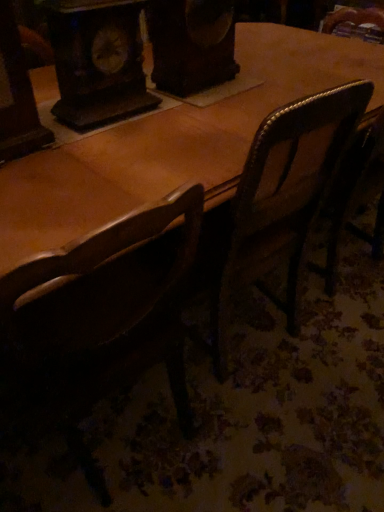
This screenshot has width=384, height=512. What are the coordinates of `brown wooden chair at left` in the screenshot? It's located at (105, 298).

The image size is (384, 512). Describe the element at coordinates (105, 298) in the screenshot. I see `brown wooden chair at left` at that location.

What do you see at coordinates (98, 61) in the screenshot? I see `wooden clock at upper left` at bounding box center [98, 61].

The image size is (384, 512). Identify the location of wooden clock at upper left. (98, 61).

The width and height of the screenshot is (384, 512). What are the coordinates of `brown wooden chair at left` in the screenshot? It's located at (105, 298).

Is brown wooden chair at left to the right of wooden clock at upper left from the viewer's perspective?

Yes.

Is brown wooden chair at left further to the viewer compared to wooden clock at upper left?

No, it is not.

Does point (15, 307) come behind point (134, 38)?

That is False.

From the image's perspective, between brown wooden chair at left and wooden clock at upper left, who is located below?

brown wooden chair at left appears lower in the image.

From a real-world perspective, is brown wooden chair at left over wooden clock at upper left?

Actually, brown wooden chair at left is physically below wooden clock at upper left in the real world.

In the scene shown: Looking at their sizes, would you say brown wooden chair at left is wider or thinner than wooden clock at upper left?

Result: Considering their sizes, brown wooden chair at left looks broader than wooden clock at upper left.

Can you confirm if brown wooden chair at left is shorter than wooden clock at upper left?

No.

Between brown wooden chair at left and wooden clock at upper left, which one has larger size?

brown wooden chair at left is bigger.

Is brown wooden chair at left outside of wooden clock at upper left?

Yes.

Would you consider brown wooden chair at left to be distant from wooden clock at upper left?

No, brown wooden chair at left is not far from wooden clock at upper left.

Is brown wooden chair at left facing away from wooden clock at upper left?

That's not correct — brown wooden chair at left is not looking away from wooden clock at upper left.

What's the angular difference between brown wooden chair at left and wooden clock at upper left's facing directions?

177 degrees separate the facing orientations of brown wooden chair at left and wooden clock at upper left.

Identify the location of chair in front of the wooden clock at upper left. The image size is (384, 512). (105, 298).

Is wooden clock at upper left to the left of brown wooden chair at left from the viewer's perspective?

Yes.

Which object is closer to the camera, wooden clock at upper left or brown wooden chair at left?

brown wooden chair at left.

Which is behind, point (98, 84) or point (25, 275)?

The point (98, 84) is more distant.

From the image's perspective, is wooden clock at upper left beneath brown wooden chair at left?

No.

In the scene shown: From a real-world perspective, who is located higher, wooden clock at upper left or brown wooden chair at left?

In real-world perspective, wooden clock at upper left is above.

Can you confirm if wooden clock at upper left is wider than brown wooden chair at left?

No, wooden clock at upper left is not wider than brown wooden chair at left.

Can you confirm if wooden clock at upper left is shorter than brown wooden chair at left?

Yes.

Can you confirm if wooden clock at upper left is bigger than brown wooden chair at left?

Incorrect, wooden clock at upper left is not larger than brown wooden chair at left.

Does wooden clock at upper left contain brown wooden chair at left?

No, brown wooden chair at left is not inside wooden clock at upper left.

Is wooden clock at upper left next to brown wooden chair at left?

No, wooden clock at upper left is not next to brown wooden chair at left.

Is wooden clock at upper left turned away from brown wooden chair at left?

wooden clock at upper left is not turned away from brown wooden chair at left.

How much distance is there between wooden clock at upper left and brown wooden chair at left?

wooden clock at upper left and brown wooden chair at left are 21.56 inches apart from each other.

In the image, there is a wooden clock at upper left. Where is `chair below it (from a real-world perspective)`? The image size is (384, 512). chair below it (from a real-world perspective) is located at coordinates (105, 298).

At what (x,y) coordinates should I click in order to perform the action: click on clock above the brown wooden chair at left (from the image's perspective). Please return your answer as a coordinate pair (x, y). This screenshot has height=512, width=384. Looking at the image, I should click on (98, 61).

Where is `chair beneath the wooden clock at upper left (from a real-world perspective)`? This screenshot has width=384, height=512. chair beneath the wooden clock at upper left (from a real-world perspective) is located at coordinates (105, 298).